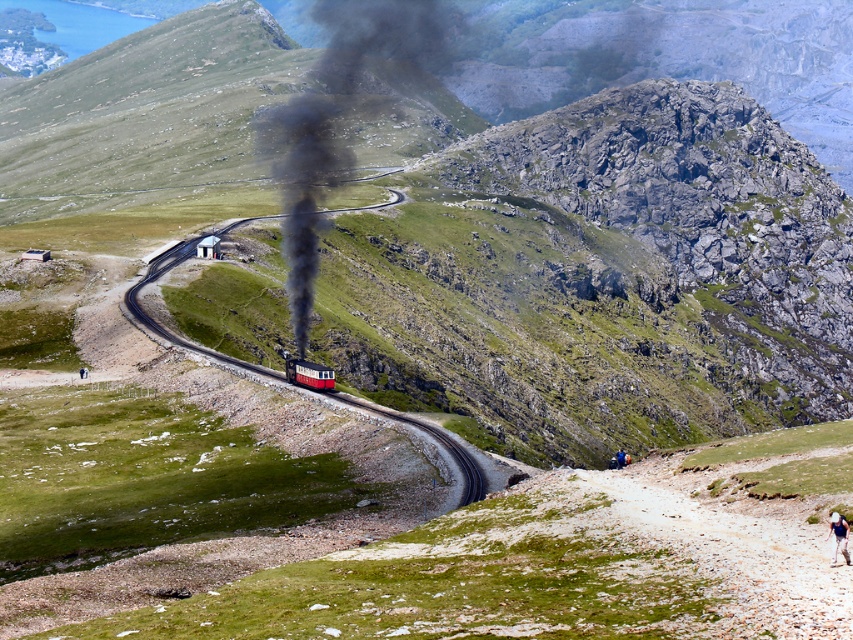
Question: Is green mossy dirt path at lower right behind polished wood passenger train at center?

Choices:
 (A) yes
 (B) no

Answer: (B)

Question: Does green mossy dirt path at lower right have a lesser width compared to matte red train at center?

Choices:
 (A) yes
 (B) no

Answer: (B)

Question: Which object is positioned farthest from the matte red train at center?

Choices:
 (A) black smoke at center
 (B) polished wood passenger train at center
 (C) green mossy dirt path at lower right
 (D) white cotton shirt at lower right

Answer: (A)

Question: Is green mossy dirt path at lower right thinner than white cotton shirt at lower right?

Choices:
 (A) yes
 (B) no

Answer: (B)

Question: Which of these objects is positioned farthest from the matte red train at center?

Choices:
 (A) polished wood passenger train at center
 (B) green mossy dirt path at lower right

Answer: (B)

Question: Which point is closer to the camera taking this photo?

Choices:
 (A) (331, 372)
 (B) (705, 468)

Answer: (B)